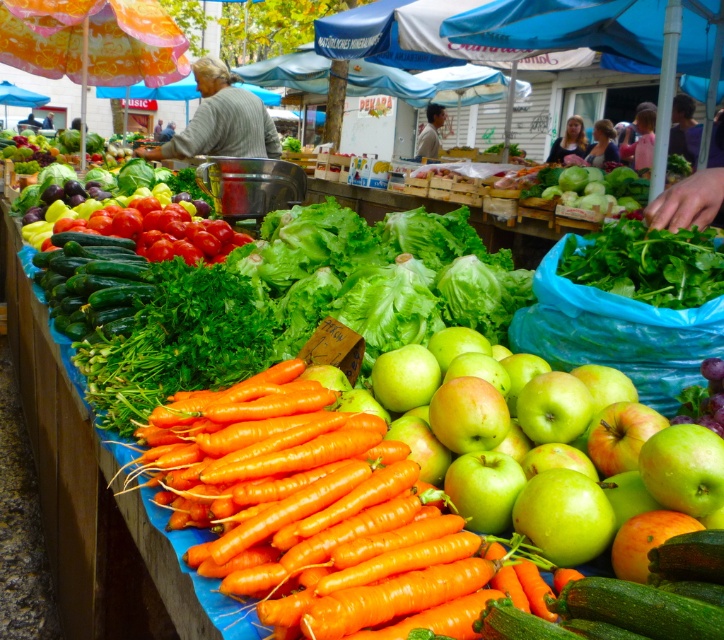
Question: Considering the real-world distances, which object is closest to the green leafy at center?

Choices:
 (A) green matte apple at center
 (B) orange smooth carrots at center

Answer: (A)

Question: Which object is the farthest from the orange smooth carrots at center?

Choices:
 (A) green matte apple at center
 (B) green leafy at center

Answer: (B)

Question: Can you confirm if orange smooth carrots at center is positioned to the left of green leafy at center?

Choices:
 (A) yes
 (B) no

Answer: (A)

Question: Observing the image, what is the correct spatial positioning of orange smooth carrots at center in reference to green matte apple at center?

Choices:
 (A) left
 (B) right

Answer: (A)

Question: Which object appears closest to the camera in this image?

Choices:
 (A) green matte apple at center
 (B) green leafy at center

Answer: (A)

Question: In this image, where is green matte apple at center located relative to green leafy at center?

Choices:
 (A) left
 (B) right

Answer: (A)